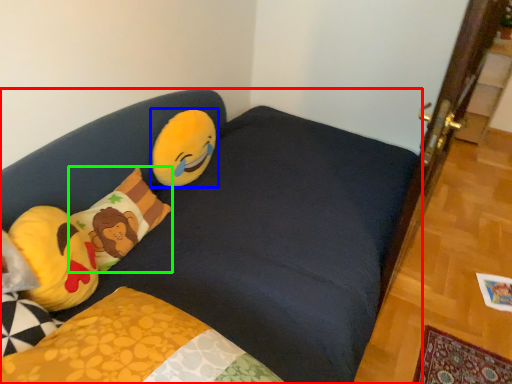
Question: Considering the real-world distances, which object is closest to studio couch (highlighted by a red box)? toy (highlighted by a blue box) or pillow (highlighted by a green box).

Choices:
 (A) toy
 (B) pillow

Answer: (B)